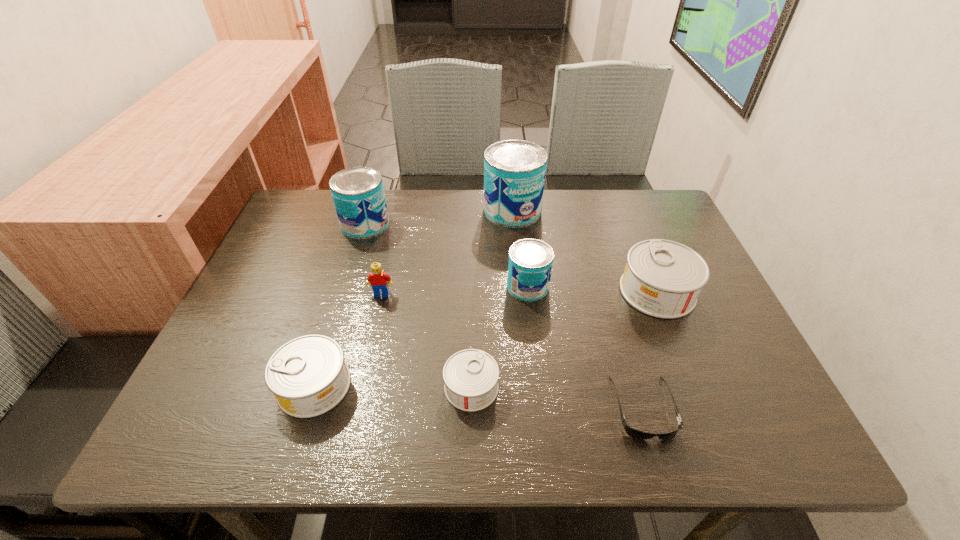
Where is `empty location between the tallest object and the seventh tallest object`? The width and height of the screenshot is (960, 540). empty location between the tallest object and the seventh tallest object is located at coordinates (492, 299).

Find the location of a particular element. The image size is (960, 540). free space between the second silver can from right to left and the smallest blue can is located at coordinates (499, 337).

Find the location of a particular element. The image size is (960, 540). blank region between the leftmost blue can and the red Lego is located at coordinates (373, 259).

Locate an element on the screen. This screenshot has height=540, width=960. unoccupied area between the leftmost silver can and the biggest blue can is located at coordinates (414, 298).

Where is `empty space that is in between the second silver can from right to left and the tallest object`? The height and width of the screenshot is (540, 960). empty space that is in between the second silver can from right to left and the tallest object is located at coordinates (492, 299).

Where is `vacant region between the nearest blue can and the Lego`? vacant region between the nearest blue can and the Lego is located at coordinates (455, 290).

Image resolution: width=960 pixels, height=540 pixels. Identify the location of object that can be found as the seventh closest to the seventh tallest object. (514, 170).

Identify the location of the seventh closest object to the nearest blue can. (308, 376).

Point out which can is positioned as the second nearest to the shortest object. Please provide its 2D coordinates. Your answer should be formatted as a tuple, i.e. [(x, y)], where the tuple contains the x and y coordinates of a point satisfying the conditions above.

[(470, 376)]

Identify the location of can that is the third closest to the smallest blue can. This screenshot has height=540, width=960. (514, 170).